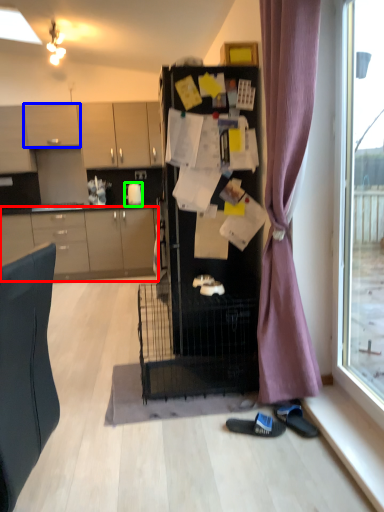
Question: Estimate the real-world distances between objects in this image. Which object is closer to cabinetry (highlighted by a red box), cabinetry (highlighted by a blue box) or teapot (highlighted by a green box)?

Choices:
 (A) cabinetry
 (B) teapot

Answer: (B)